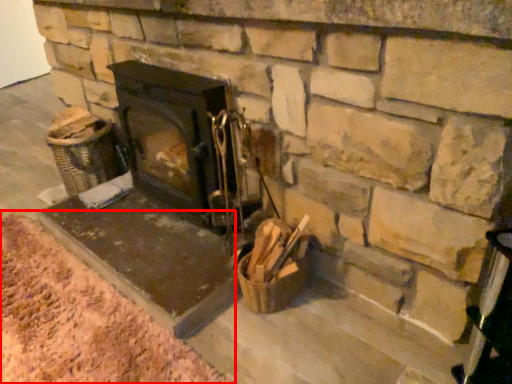
Question: From the image's perspective, what is the correct spatial relationship of debris (annotated by the red box) in relation to wood burning stove?

Choices:
 (A) below
 (B) above

Answer: (A)